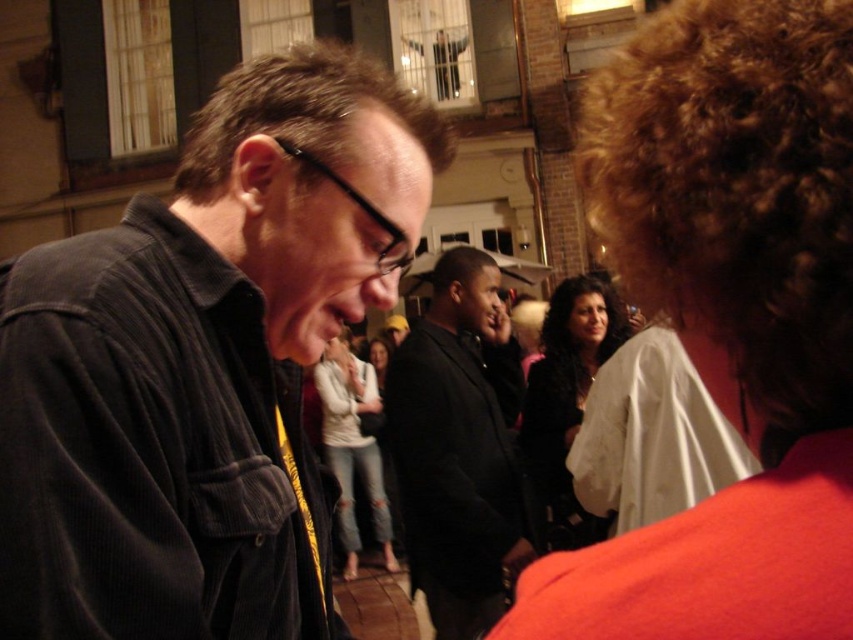
You are standing at the point labeled point (305, 241) and want to take a photo of the scene. If your camera has a maximum focus range of 3.5 meters, will it be able to capture the entire scene clearly?

The distance between point (305, 241) and the camera is 4.00 meters. Since the camera can only focus up to 3.5 meters, it will not be able to capture the scene clearly at this distance.

You are a photographer at the event and want to ensure both the shiny black hair at center and the matte white shirt at center are fully visible in your photo. Given their relative heights, which object might require you to adjust your camera angle to avoid being cut off?

The shiny black hair at center is taller than the matte white shirt at center, so adjusting the camera angle to account for its height would help ensure it isn

You are a photographer at this event and want to focus on the black matte suit at center and the matte white shirt at center. Which one is positioned closer to the camera?

The black matte suit at center is closer to the viewer than the matte white shirt at center, so it would be the one closer to the camera.